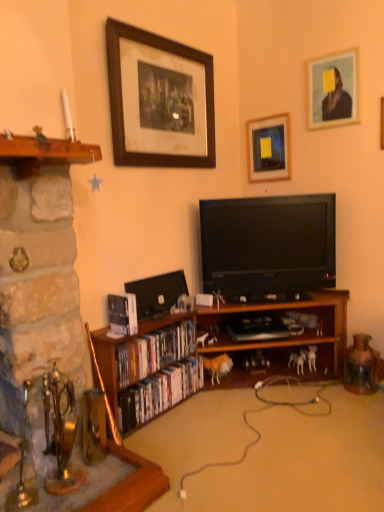
Locate an element on the screen. vacant position to the left of rusty metal jug at lower right is located at coordinates (332, 394).